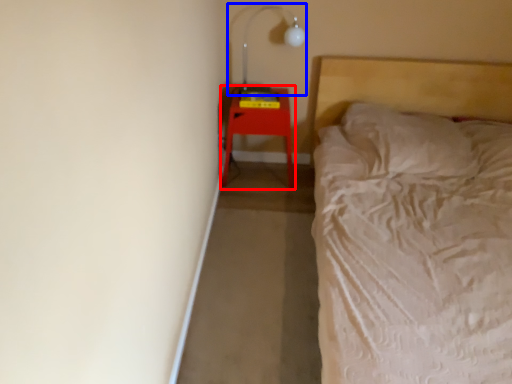
Question: Which of the following is the farthest to the observer, furniture (highlighted by a red box) or lamp (highlighted by a blue box)?

Choices:
 (A) furniture
 (B) lamp

Answer: (A)